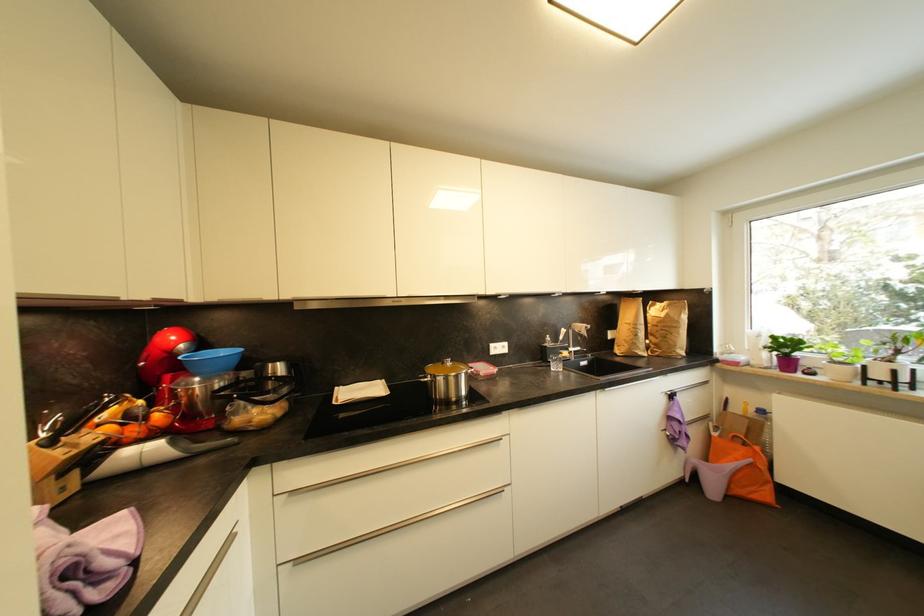
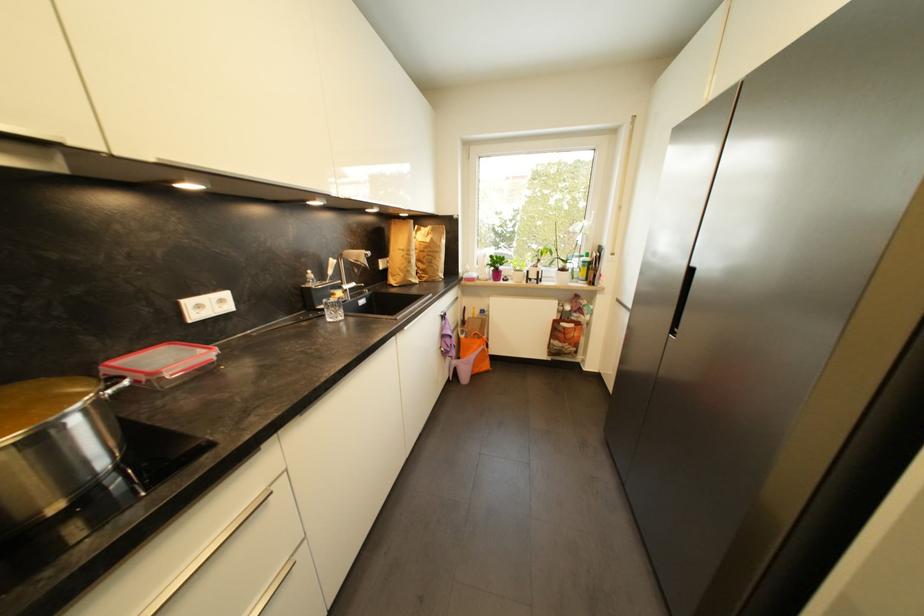
Where in the second image is the point corresponding to [720,436] from the first image?

(468, 339)